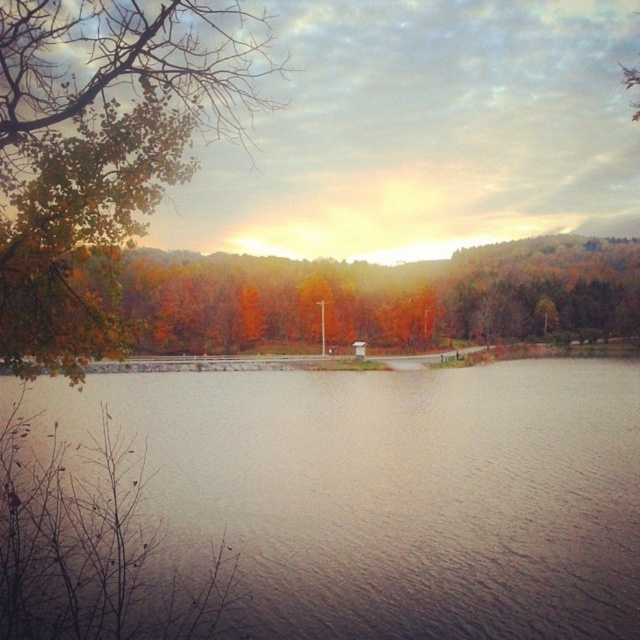
Question: Which object is closer to the camera taking this photo?

Choices:
 (A) smooth water at center
 (B) green matte tree at upper left
 (C) autumn leaves at center

Answer: (B)

Question: Does green matte tree at upper left appear over autumn leaves at center?

Choices:
 (A) no
 (B) yes

Answer: (B)

Question: Does smooth water at center appear over autumn leaves at center?

Choices:
 (A) yes
 (B) no

Answer: (B)

Question: Is smooth water at center positioned in front of green matte tree at upper left?

Choices:
 (A) yes
 (B) no

Answer: (B)

Question: Which is farther from the smooth water at center?

Choices:
 (A) green matte tree at upper left
 (B) autumn leaves at center

Answer: (B)

Question: Among these points, which one is farthest from the camera?

Choices:
 (A) (108, 120)
 (B) (612, 314)

Answer: (B)